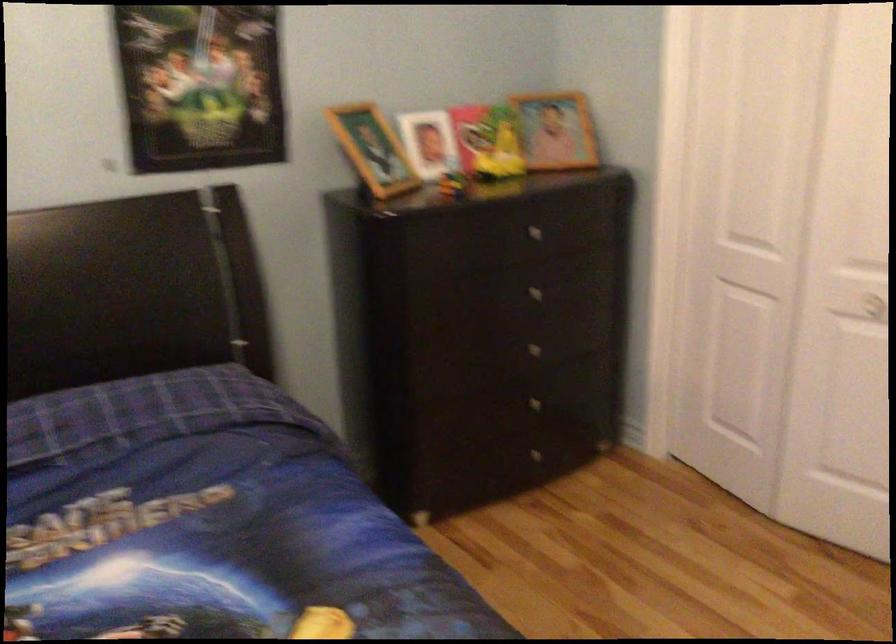
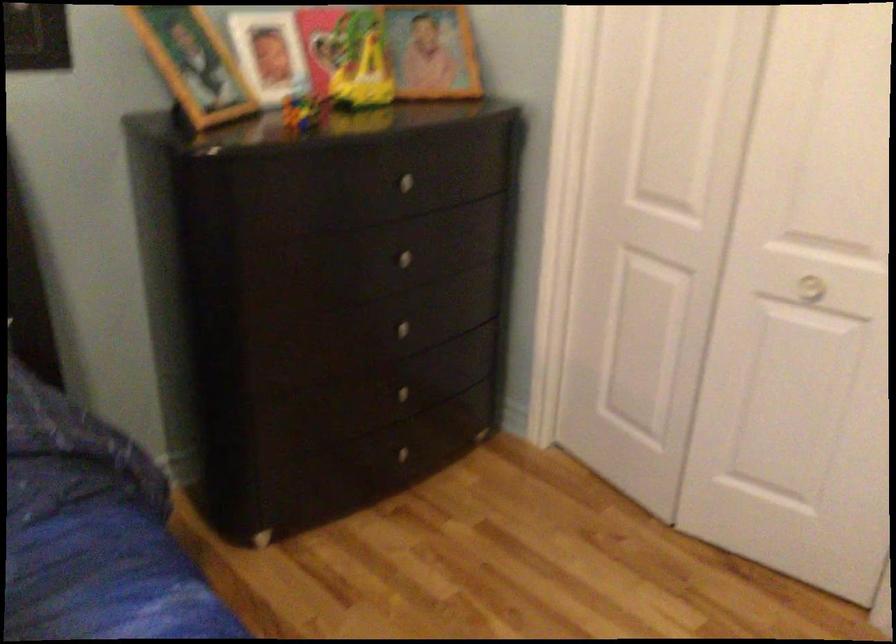
In the second image, find the point that corresponds to [539,352] in the first image.

(409, 332)